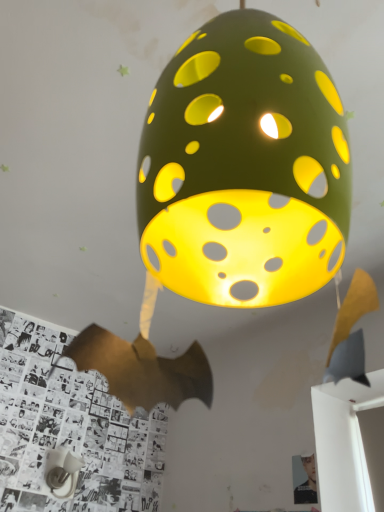
Question: Considering the positions of white matte table lamp at lower left and smooth black portrait at lower right in the image, is white matte table lamp at lower left taller or shorter than smooth black portrait at lower right?

Choices:
 (A) tall
 (B) short

Answer: (B)

Question: From the image's perspective, relative to smooth black portrait at lower right, is white matte table lamp at lower left above or below?

Choices:
 (A) above
 (B) below

Answer: (B)

Question: Which is correct: white matte table lamp at lower left is inside smooth black portrait at lower right, or outside of it?

Choices:
 (A) inside
 (B) outside

Answer: (B)

Question: From the image's perspective, is smooth black portrait at lower right located above or below white matte table lamp at lower left?

Choices:
 (A) below
 (B) above

Answer: (B)

Question: From their relative heights in the image, would you say smooth black portrait at lower right is taller or shorter than white matte table lamp at lower left?

Choices:
 (A) short
 (B) tall

Answer: (B)

Question: Is smooth black portrait at lower right spatially inside white matte table lamp at lower left, or outside of it?

Choices:
 (A) outside
 (B) inside

Answer: (A)

Question: In the image, is smooth black portrait at lower right positioned in front of or behind white matte table lamp at lower left?

Choices:
 (A) behind
 (B) front

Answer: (B)